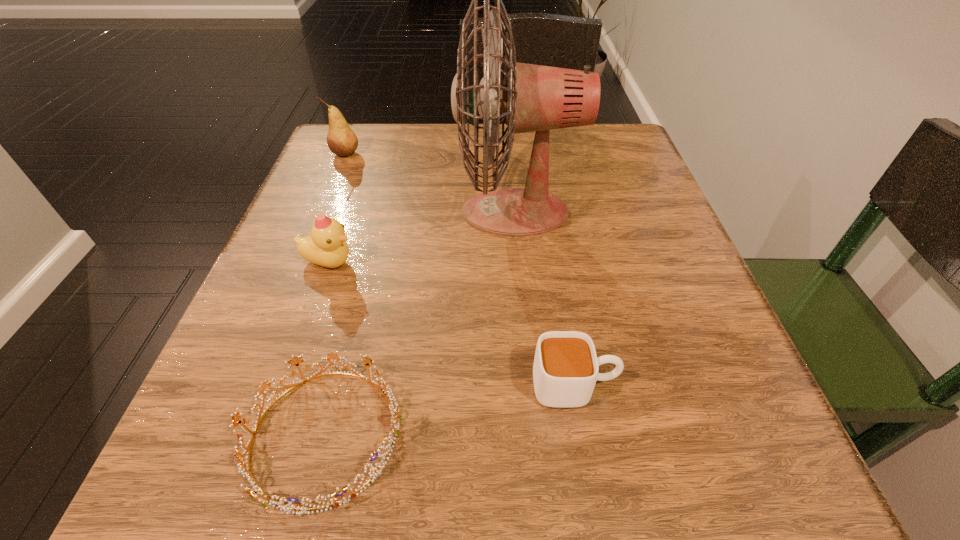
Where is `free space located on the front-facing side of the duckling`? The image size is (960, 540). free space located on the front-facing side of the duckling is located at coordinates (583, 263).

This screenshot has width=960, height=540. What are the coordinates of `vacant space located 0.110m on the side with the handle of the cup` in the screenshot? It's located at (704, 386).

Find the location of a particular element. free space located 0.300m on the front-facing side of the tiara is located at coordinates coord(663,435).

At what (x,y) coordinates should I click in order to perform the action: click on fan at the far edge. Please return your answer as a coordinate pair (x, y). The height and width of the screenshot is (540, 960). Looking at the image, I should click on (538, 98).

Where is `pear situated at the far edge`? The width and height of the screenshot is (960, 540). pear situated at the far edge is located at coordinates (341, 140).

Where is `object that is at the near edge`? object that is at the near edge is located at coordinates (395, 415).

At what (x,y) coordinates should I click in order to perform the action: click on pear that is positioned at the left edge. Please return your answer as a coordinate pair (x, y). This screenshot has height=540, width=960. Looking at the image, I should click on (341, 140).

Find the location of a particular element. The width and height of the screenshot is (960, 540). duckling present at the left edge is located at coordinates (326, 246).

You are a GUI agent. You are given a task and a screenshot of the screen. Output one action in this format:
    pyautogui.click(x=<x>, y=<y>)
    Task: Click on the tiara located at the left edge
    Image resolution: width=960 pixels, height=540 pixels.
    Given the screenshot: What is the action you would take?
    pyautogui.click(x=395, y=415)

You are a GUI agent. You are given a task and a screenshot of the screen. Output one action in this format:
    pyautogui.click(x=<x>, y=<y>)
    Task: Click on the object at the far left corner
    
    Given the screenshot: What is the action you would take?
    pyautogui.click(x=341, y=140)